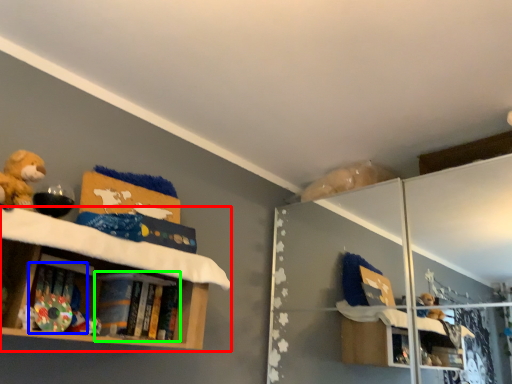
Question: Which object is positioned farthest from shelf (highlighted by a red box)? Select from book (highlighted by a blue box) and book (highlighted by a green box).

Choices:
 (A) book
 (B) book

Answer: (A)